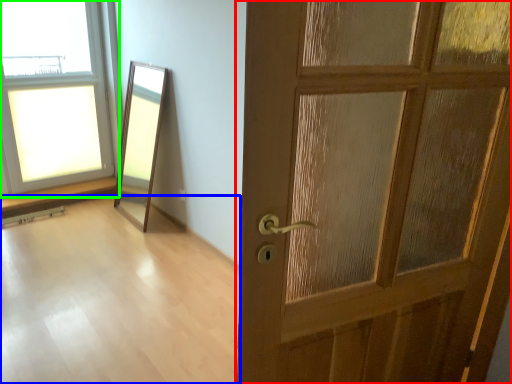
Question: Which object is the farthest from door (highlighted by a red box)? Choose among these: corridor (highlighted by a blue box) or window (highlighted by a green box).

Choices:
 (A) corridor
 (B) window

Answer: (B)